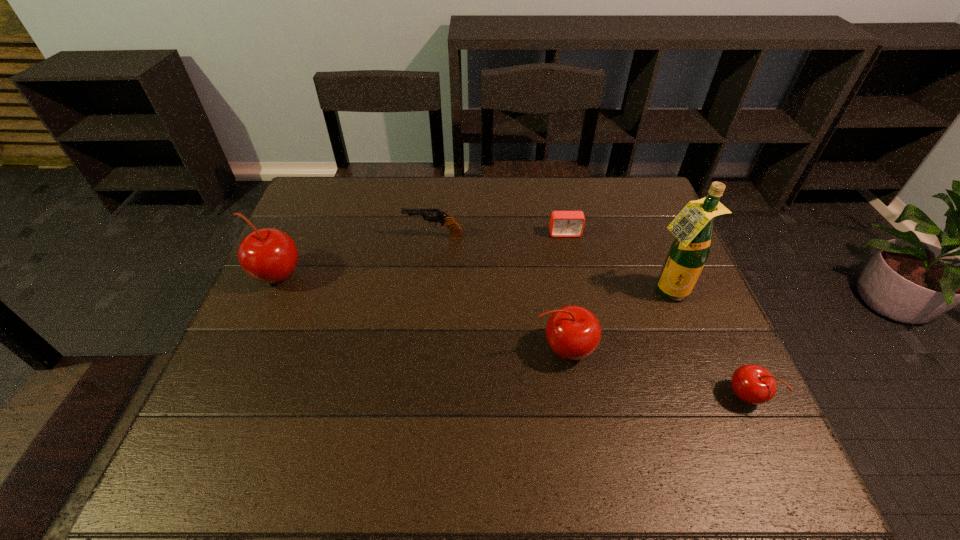
This screenshot has height=540, width=960. Identify the location of cherry that is the closest to the leftmost cherry. tap(573, 332).

Find the location of a particular element. This screenshot has height=540, width=960. free space that satisfies the following two spatial constraints: 1. on the front-facing side of the rightmost cherry; 2. on the right side of the shortest object is located at coordinates point(598,396).

Where is `vacant point that satisfies the following two spatial constraints: 1. on the front-facing side of the shortest cherry; 2. on the right side of the alarm clock`? vacant point that satisfies the following two spatial constraints: 1. on the front-facing side of the shortest cherry; 2. on the right side of the alarm clock is located at coordinates (598, 396).

This screenshot has width=960, height=540. I want to click on free space that satisfies the following two spatial constraints: 1. on the front-facing side of the tallest object; 2. on the right side of the shortest cherry, so click(709, 396).